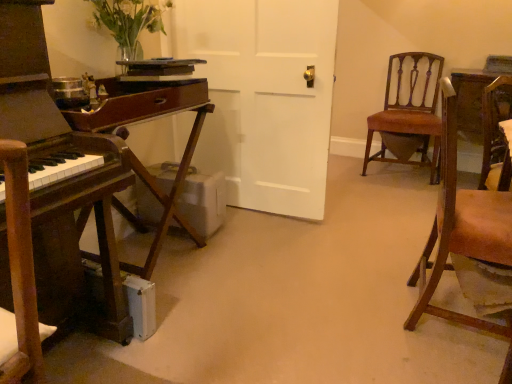
Question: Relative to translucent glass vase at upper left, is brown wooden desk at left in front or behind?

Choices:
 (A) behind
 (B) front

Answer: (B)

Question: From the image's perspective, relative to translucent glass vase at upper left, is brown wooden desk at left above or below?

Choices:
 (A) below
 (B) above

Answer: (A)

Question: Estimate the real-world distances between objects in this image. Which object is farther from the brown leather chair at right, arranged as the second chair when viewed from the back?

Choices:
 (A) brown wood table at left
 (B) translucent glass vase at upper left
 (C) brown leather chair at right, acting as the first chair starting from the back
 (D) brown wooden desk at left

Answer: (C)

Question: Which is farther from the brown wooden desk at left?

Choices:
 (A) translucent glass vase at upper left
 (B) brown leather chair at right, acting as the first chair starting from the back
 (C) brown wood table at left
 (D) brown leather chair at right, arranged as the second chair when viewed from the back

Answer: (B)